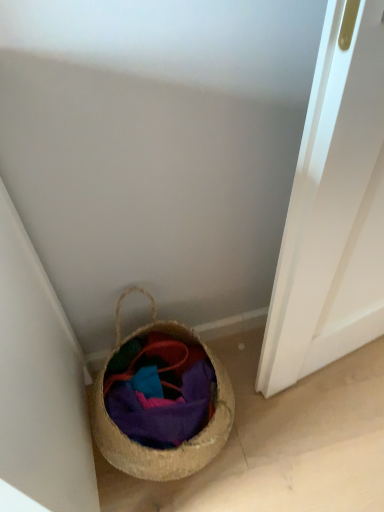
Measure the distance between point (137, 379) and camera.

The distance of point (137, 379) from camera is 3.61 feet.

Locate an element on the screen. The height and width of the screenshot is (512, 384). multicolored woven basket at lower left is located at coordinates (160, 390).

The width and height of the screenshot is (384, 512). Describe the element at coordinates (160, 390) in the screenshot. I see `multicolored woven basket at lower left` at that location.

Image resolution: width=384 pixels, height=512 pixels. What are the coordinates of `woven straw basket at lower left` in the screenshot? It's located at (154, 449).

Image resolution: width=384 pixels, height=512 pixels. What do you see at coordinates (154, 449) in the screenshot?
I see `woven straw basket at lower left` at bounding box center [154, 449].

Where is `multicolored woven basket at lower left`? This screenshot has height=512, width=384. multicolored woven basket at lower left is located at coordinates pos(160,390).

Is multicolored woven basket at lower left to the left of woven straw basket at lower left from the viewer's perspective?

No, multicolored woven basket at lower left is not to the left of woven straw basket at lower left.

Relative to woven straw basket at lower left, is multicolored woven basket at lower left in front or behind?

multicolored woven basket at lower left is behind woven straw basket at lower left.

Looking at this image, which is closer, (191,401) or (144,455)?

Point (191,401) is farther from the camera than point (144,455).

From the image's perspective, is multicolored woven basket at lower left located beneath woven straw basket at lower left?

Yes, from the image's perspective, multicolored woven basket at lower left is beneath woven straw basket at lower left.

From a real-world perspective, does multicolored woven basket at lower left sit lower than woven straw basket at lower left?

Indeed, from a real-world perspective, multicolored woven basket at lower left is positioned beneath woven straw basket at lower left.

Which object is thinner, multicolored woven basket at lower left or woven straw basket at lower left?

multicolored woven basket at lower left.

Considering the sizes of objects multicolored woven basket at lower left and woven straw basket at lower left in the image provided, who is taller, multicolored woven basket at lower left or woven straw basket at lower left?

With more height is woven straw basket at lower left.

Looking at this image, who is bigger, multicolored woven basket at lower left or woven straw basket at lower left?

With larger size is woven straw basket at lower left.

Is multicolored woven basket at lower left positioned beyond the bounds of woven straw basket at lower left?

No, multicolored woven basket at lower left is not outside of woven straw basket at lower left.

Are multicolored woven basket at lower left and woven straw basket at lower left beside each other?

Yes, multicolored woven basket at lower left is in contact with woven straw basket at lower left.

Is multicolored woven basket at lower left looking in the opposite direction of woven straw basket at lower left?

Yes, multicolored woven basket at lower left is positioned with its back facing woven straw basket at lower left.

What's the angular difference between multicolored woven basket at lower left and woven straw basket at lower left's facing directions?

5.58 degrees.

Measure the distance between multicolored woven basket at lower left and woven straw basket at lower left.

2.64 inches.

Identify the location of basket that is on the left side of multicolored woven basket at lower left. (154, 449).

Which object is positioned more to the right, woven straw basket at lower left or multicolored woven basket at lower left?

multicolored woven basket at lower left is more to the right.

Is woven straw basket at lower left in front of multicolored woven basket at lower left?

Yes, woven straw basket at lower left is in front of multicolored woven basket at lower left.

Considering the points (137, 331) and (128, 418), which point is in front, point (137, 331) or point (128, 418)?

Point (128, 418)

From the image's perspective, which one is positioned higher, woven straw basket at lower left or multicolored woven basket at lower left?

From the image's view, woven straw basket at lower left is above.

Based on the photo, from a real-world perspective, which object rests below the other?

multicolored woven basket at lower left, from a real-world perspective.

Consider the image. Considering the relative sizes of woven straw basket at lower left and multicolored woven basket at lower left in the image provided, is woven straw basket at lower left thinner than multicolored woven basket at lower left?

No.

Considering the sizes of objects woven straw basket at lower left and multicolored woven basket at lower left in the image provided, who is taller, woven straw basket at lower left or multicolored woven basket at lower left?

With more height is woven straw basket at lower left.

Who is smaller, woven straw basket at lower left or multicolored woven basket at lower left?

With smaller size is multicolored woven basket at lower left.

Is woven straw basket at lower left completely or partially outside of multicolored woven basket at lower left?

Yes, woven straw basket at lower left is outside of multicolored woven basket at lower left.

Can you see woven straw basket at lower left touching multicolored woven basket at lower left?

Absolutely, woven straw basket at lower left is next to and touching multicolored woven basket at lower left.

Is woven straw basket at lower left oriented away from multicolored woven basket at lower left?

Yes, woven straw basket at lower left is positioned with its back facing multicolored woven basket at lower left.

How many degrees apart are the facing directions of woven straw basket at lower left and multicolored woven basket at lower left?

The angle between the facing direction of woven straw basket at lower left and the facing direction of multicolored woven basket at lower left is 5.58 degrees.

This screenshot has height=512, width=384. I want to click on fabric below the woven straw basket at lower left (from the image's perspective), so click(x=160, y=390).

This screenshot has height=512, width=384. I want to click on basket above the multicolored woven basket at lower left (from a real-world perspective), so click(154, 449).

Where is `fabric that appears behind the woven straw basket at lower left`? fabric that appears behind the woven straw basket at lower left is located at coordinates (160, 390).